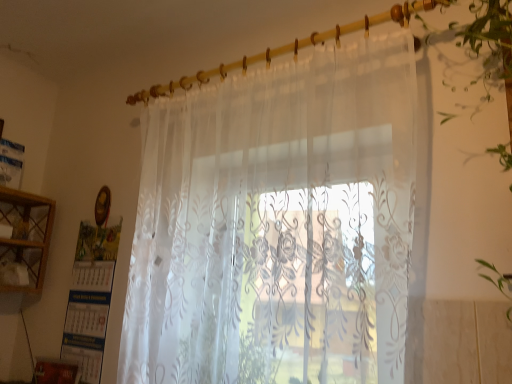
Question: Does point (45, 249) appear closer or farther from the camera than point (222, 364)?

Choices:
 (A) farther
 (B) closer

Answer: (A)

Question: From a real-world perspective, is wooden cabinet at left physically located above or below translucent floral-patterned curtain at center?

Choices:
 (A) above
 (B) below

Answer: (B)

Question: Which object is positioned farthest from the wooden cabinet at left?

Choices:
 (A) translucent floral-patterned curtain at center
 (B) translucent floral curtain at right

Answer: (B)

Question: Which object is the closest to the wooden cabinet at left?

Choices:
 (A) translucent floral-patterned curtain at center
 (B) translucent floral curtain at right

Answer: (A)